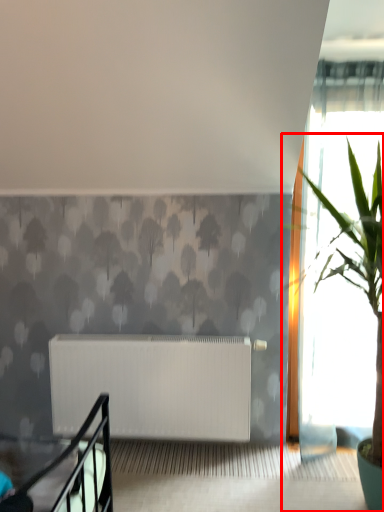
Question: From the image's perspective, where is houseplant (annotated by the red box) located in relation to radiator in the image?

Choices:
 (A) above
 (B) below

Answer: (A)